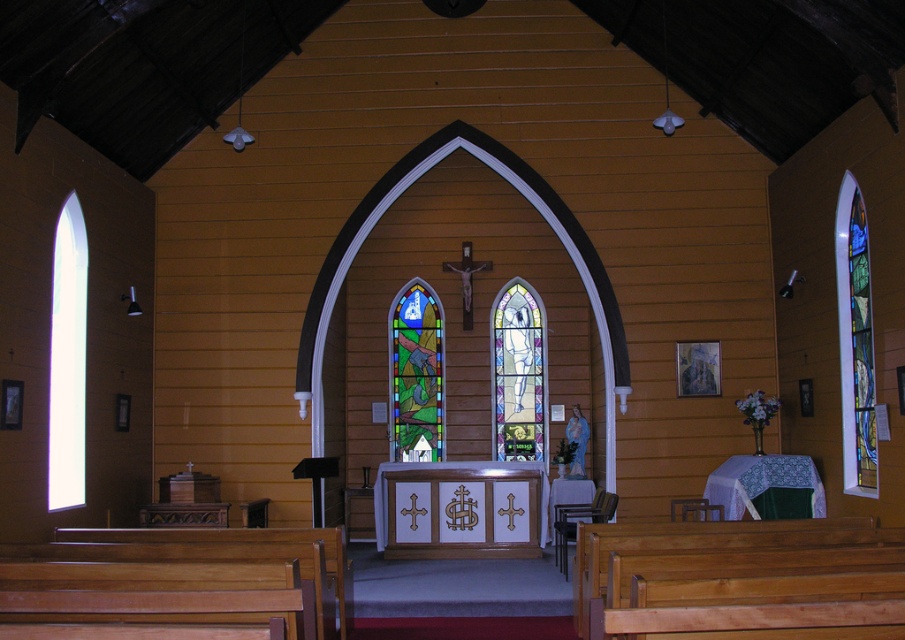
You are standing inside the wooden church and want to move from the entrance to the altar area. You see two points marked on the floor at coordinates point (642, 618) and point (53, 358). Which point should you step on first to reach the altar area?

You should step on point (642, 618) first because it is in front of point (53, 358), meaning it is closer to the altar area.

You are a window installer assessing the church interior. You need to replace the transparent glass window at left and the translucent stained glass at center. Which window requires a taller frame for installation?

The transparent glass window at left requires a taller frame for installation because it is taller than the translucent stained glass at center according to the description.